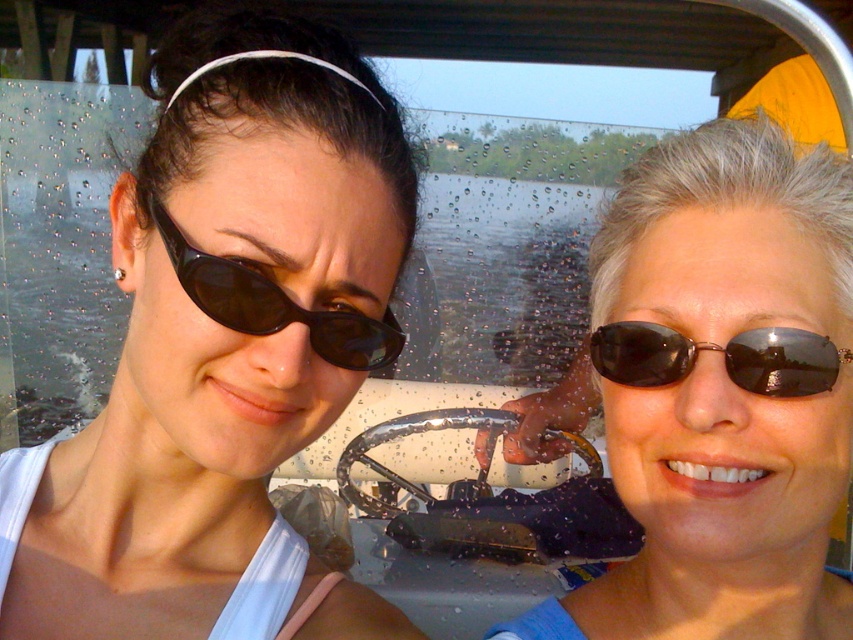
Question: In this image, where is shiny black sunglasses at center located relative to black matte sunglasses at left?

Choices:
 (A) above
 (B) below

Answer: (B)

Question: Which object is closer to the camera taking this photo?

Choices:
 (A) shiny black sunglasses at center
 (B) black matte sunglasses at left

Answer: (B)

Question: Can you confirm if shiny black sunglasses at center is bigger than black reflective sunglasses at right?

Choices:
 (A) no
 (B) yes

Answer: (B)

Question: Is shiny black sunglasses at center below black reflective sunglasses at right?

Choices:
 (A) yes
 (B) no

Answer: (A)

Question: Which point appears farthest from the camera in this image?

Choices:
 (A) (773, 532)
 (B) (775, 353)
 (C) (241, 278)

Answer: (A)

Question: Among these objects, which one is farthest from the camera?

Choices:
 (A) black reflective sunglasses at right
 (B) shiny black sunglasses at center
 (C) black matte sunglasses at left

Answer: (A)